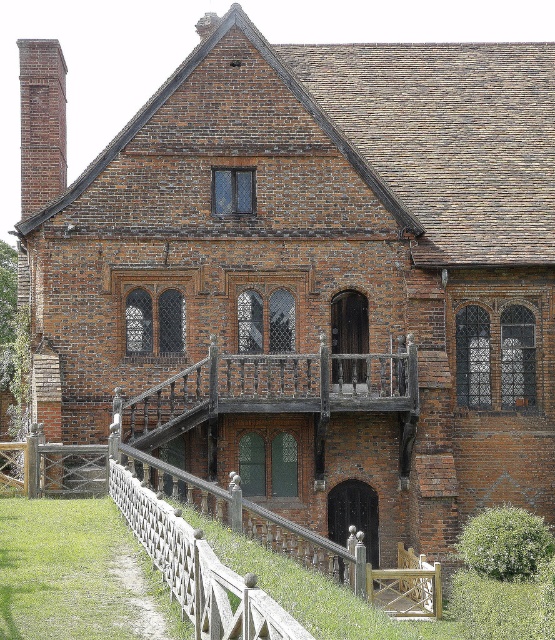
Where is `rustic wood balcony at center`? rustic wood balcony at center is located at coordinates (271, 392).

This screenshot has height=640, width=555. Describe the element at coordinates (271, 392) in the screenshot. I see `rustic wood balcony at center` at that location.

I want to click on rustic wood balcony at center, so click(x=271, y=392).

At what (x,y) coordinates should I click in order to perform the action: click on rustic wood balcony at center. Please return your answer as a coordinate pair (x, y). This screenshot has height=640, width=555. Looking at the image, I should click on (271, 392).

Does rustic wood balcony at center appear on the left side of brick chimney at left?

No, rustic wood balcony at center is not to the left of brick chimney at left.

Between point (369, 385) and point (42, 102), which one is positioned behind?

The point (42, 102) is more distant.

You are a GUI agent. You are given a task and a screenshot of the screen. Output one action in this format:
    pyautogui.click(x=<x>, y=<y>)
    Task: Click on the rustic wood balcony at center
    The height and width of the screenshot is (640, 555).
    Given the screenshot: What is the action you would take?
    pyautogui.click(x=271, y=392)

Is white wood fence at lower center thinner than brick chimney at left?

Indeed, white wood fence at lower center has a lesser width compared to brick chimney at left.

Who is lower down, white wood fence at lower center or brick chimney at left?

white wood fence at lower center

Who is more distant from viewer, (189, 582) or (26, 61)?

The point (26, 61) is more distant.

Locate an element on the screen. This screenshot has height=640, width=555. white wood fence at lower center is located at coordinates (199, 570).